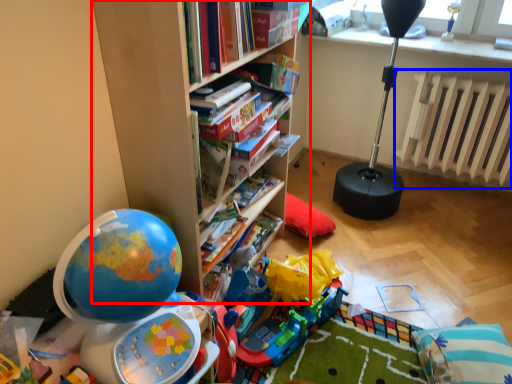
Question: Among these objects, which one is farthest to the camera, bookcase (highlighted by a red box) or radiator (highlighted by a blue box)?

Choices:
 (A) bookcase
 (B) radiator

Answer: (B)